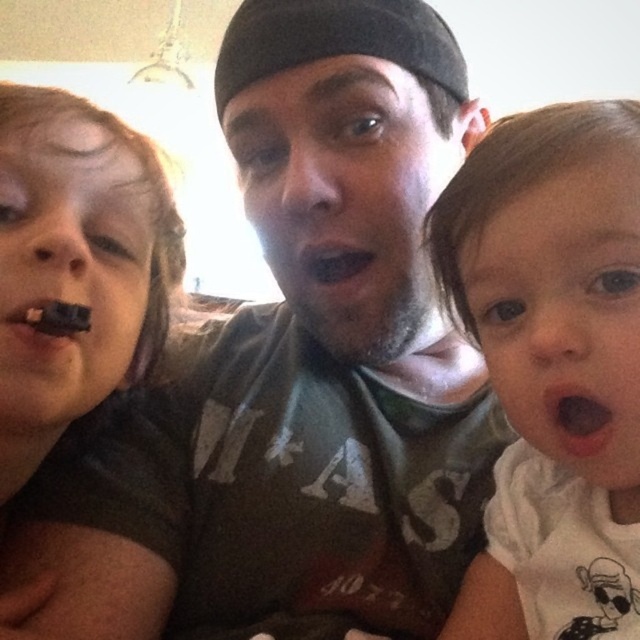
Between white soft baby at right and black matte mouth at center, which one has more height?

white soft baby at right is taller.

Is point (506, 189) farther from viewer compared to point (301, 257)?

No, it is in front of (301, 257).

Identify the location of white soft baby at right. tap(552, 365).

Is chocolate matte at left to the right of black matte mouth at center from the viewer's perspective?

Incorrect, chocolate matte at left is not on the right side of black matte mouth at center.

Measure the distance between chocolate matte at left and camera.

chocolate matte at left is 16.63 inches away from camera.

I want to click on chocolate matte at left, so click(x=44, y=324).

Between point (492, 131) and point (29, 312), which one is positioned behind?

Positioned behind is point (492, 131).

The width and height of the screenshot is (640, 640). What are the coordinates of `white soft baby at right` in the screenshot? It's located at (552, 365).